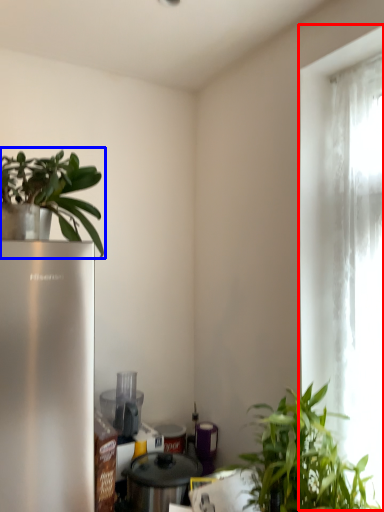
Question: Which object is closer to the camera taking this photo, window (highlighted by a red box) or houseplant (highlighted by a blue box)?

Choices:
 (A) window
 (B) houseplant

Answer: (B)